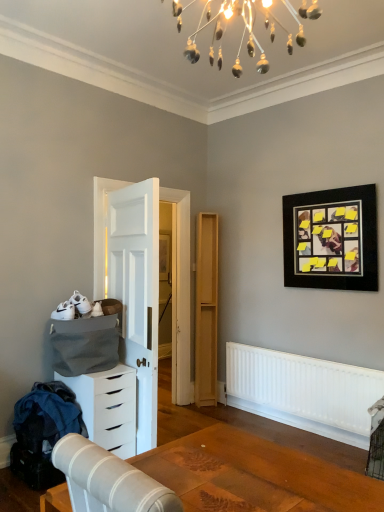
Identify the location of vacant space situated above white wooden door at center (from a real-world perspective). This screenshot has height=512, width=384. (140, 180).